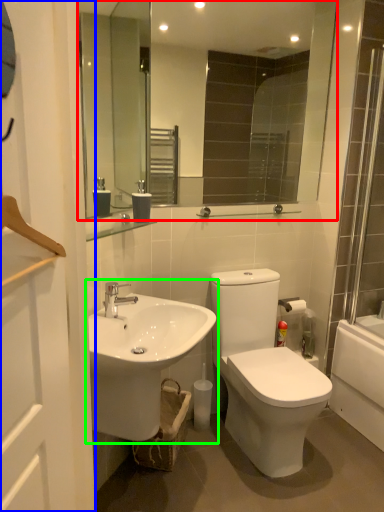
Question: Estimate the real-world distances between objects in this image. Which object is farther from mirror (highlighted by a red box), screen door (highlighted by a blue box) or sink (highlighted by a green box)?

Choices:
 (A) screen door
 (B) sink

Answer: (A)